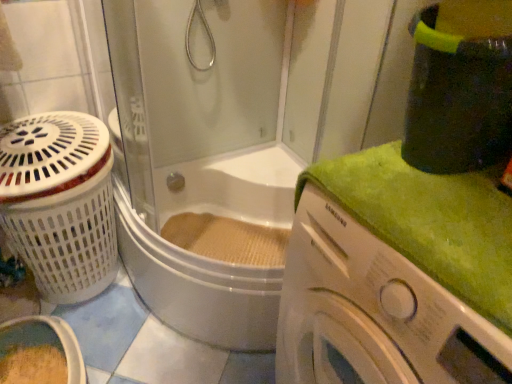
Question: Looking at the image, does white plastic laundry basket at left seem bigger or smaller compared to transparent glass shower door at upper center?

Choices:
 (A) small
 (B) big

Answer: (A)

Question: Would you say white plastic laundry basket at left is inside or outside transparent glass shower door at upper center?

Choices:
 (A) outside
 (B) inside

Answer: (A)

Question: Estimate the real-world distances between objects in this image. Which object is farther from the white plastic laundry basket at left?

Choices:
 (A) transparent glass shower door at upper center
 (B) white glossy washing machine at right

Answer: (B)

Question: Which is nearer to the white glossy washing machine at right?

Choices:
 (A) transparent glass shower door at upper center
 (B) white plastic laundry basket at left

Answer: (A)